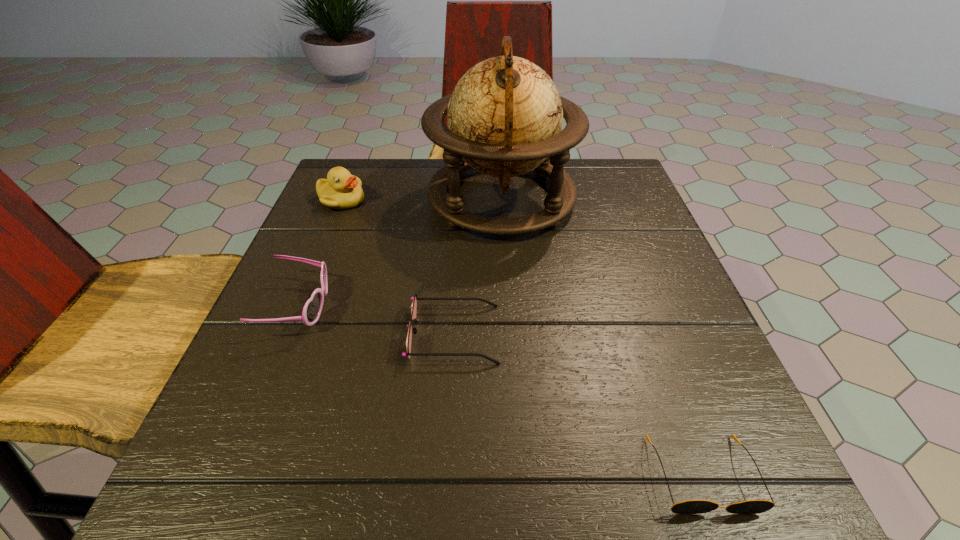
You are a GUI agent. You are given a task and a screenshot of the screen. Output one action in this format:
    pyautogui.click(x=<x>, y=<y>)
    Task: Click on the free space in the image that satisfies the following two spatial constraints: 1. on the front side of the tallest object; 2. on the front-facing side of the tallest sunglasses
    The height and width of the screenshot is (540, 960).
    Given the screenshot: What is the action you would take?
    pyautogui.click(x=509, y=307)

At what (x,y) coordinates should I click in order to perform the action: click on free space that satisfies the following two spatial constraints: 1. on the front side of the globe; 2. on the front-facing side of the third shortest object. Please return your answer as a coordinate pair (x, y). This screenshot has height=540, width=960. Looking at the image, I should click on (509, 307).